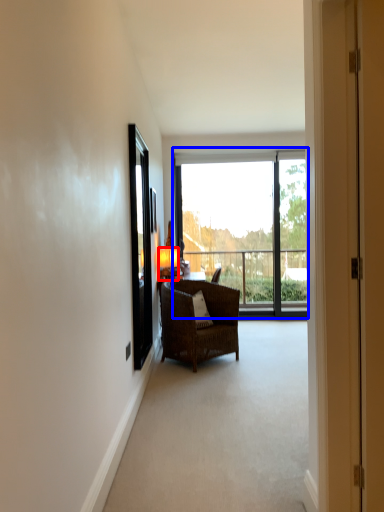
Question: Which of the following is the farthest to the observer, lamp (highlighted by a red box) or window (highlighted by a blue box)?

Choices:
 (A) lamp
 (B) window

Answer: (B)